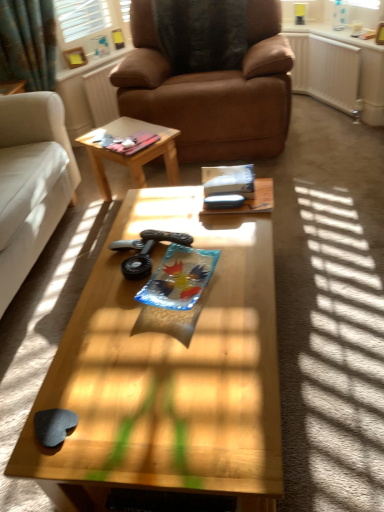
Question: Can you confirm if white fabric studio couch at left is shorter than black plastic game controller at center?

Choices:
 (A) no
 (B) yes

Answer: (A)

Question: Can you confirm if white fabric studio couch at left is smaller than black plastic game controller at center?

Choices:
 (A) no
 (B) yes

Answer: (A)

Question: Is white fabric studio couch at left at the left side of black plastic game controller at center?

Choices:
 (A) yes
 (B) no

Answer: (A)

Question: Is white fabric studio couch at left far away from black plastic game controller at center?

Choices:
 (A) yes
 (B) no

Answer: (B)

Question: Are white fabric studio couch at left and black plastic game controller at center making contact?

Choices:
 (A) yes
 (B) no

Answer: (B)

Question: Is white fabric studio couch at left further to camera compared to black plastic game controller at center?

Choices:
 (A) yes
 (B) no

Answer: (B)

Question: Is black plastic game controller at center thinner than white fabric studio couch at left?

Choices:
 (A) no
 (B) yes

Answer: (B)

Question: Considering the relative sizes of black plastic game controller at center and white fabric studio couch at left in the image provided, is black plastic game controller at center wider than white fabric studio couch at left?

Choices:
 (A) no
 (B) yes

Answer: (A)

Question: Does black plastic game controller at center have a smaller size compared to white fabric studio couch at left?

Choices:
 (A) yes
 (B) no

Answer: (A)

Question: Is black plastic game controller at center positioned before white fabric studio couch at left?

Choices:
 (A) no
 (B) yes

Answer: (A)

Question: Is black plastic game controller at center far from white fabric studio couch at left?

Choices:
 (A) no
 (B) yes

Answer: (A)

Question: Does black plastic game controller at center appear on the right side of white fabric studio couch at left?

Choices:
 (A) no
 (B) yes

Answer: (B)

Question: From the image's perspective, is brown leather radiator at upper center, acting as the first radiator starting from the left, located above white plastic radiator at upper right, arranged as the second radiator when viewed from the left?

Choices:
 (A) yes
 (B) no

Answer: (B)